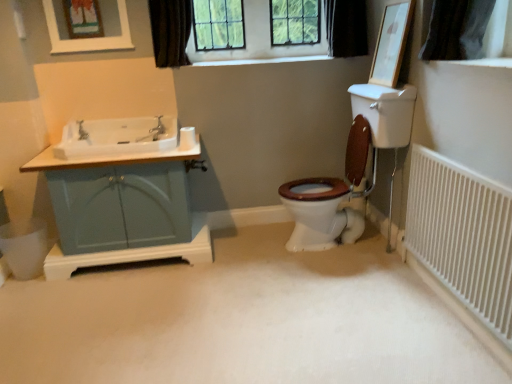
Find the location of a particular element. Image resolution: width=512 pixels, height=384 pixels. vacant space underneath clear glass window at upper center (from a real-world perspective) is located at coordinates (262, 55).